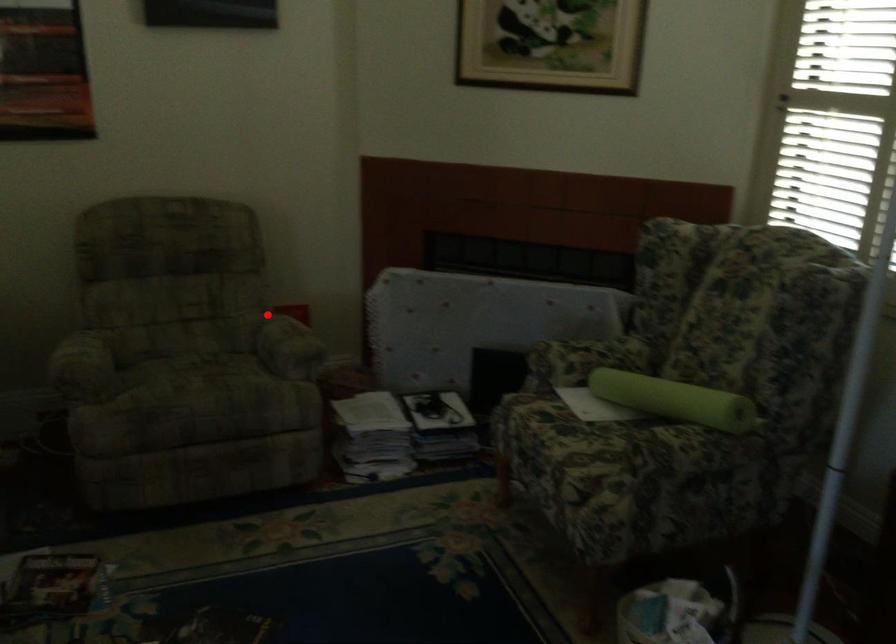
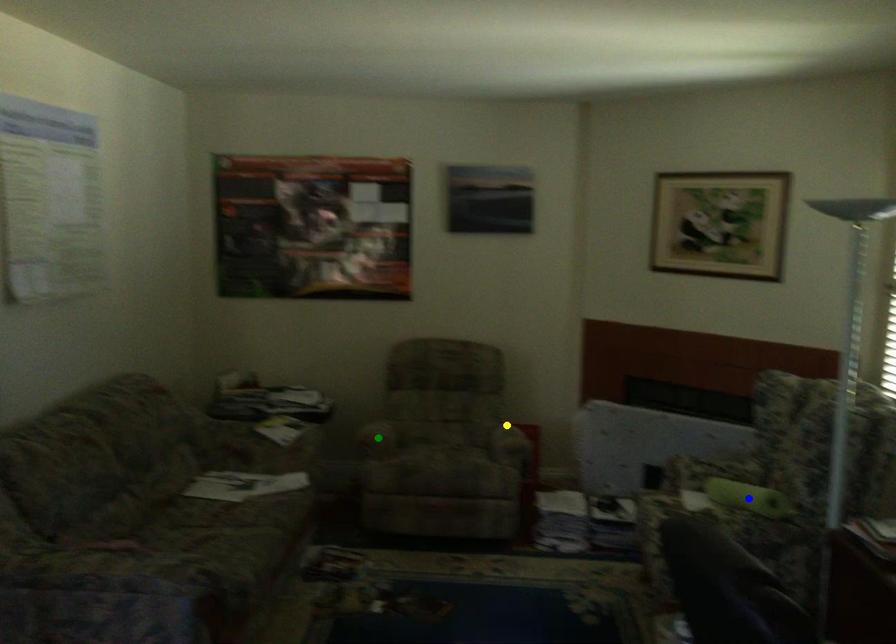
Question: I am providing you with two images of the same scene from different viewpoints. A red point is marked on the first image. You are given multiple points on the second image. Which point in image 2 is actually the same real-world point as the red point in image 1?

Choices:
 (A) green point
 (B) yellow point
 (C) blue point

Answer: (B)